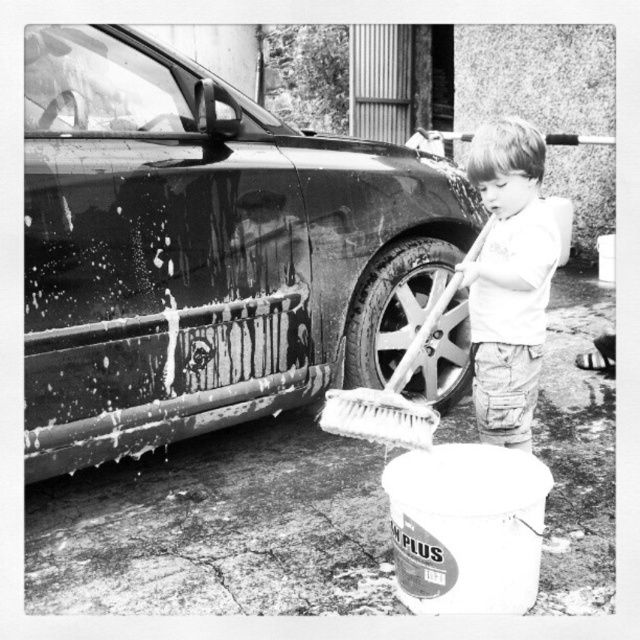
From the picture: Does shiny black car at left lie behind white bristle brush at lower center?

That is True.

Does shiny black car at left appear on the left side of white bristle brush at lower center?

Correct, you'll find shiny black car at left to the left of white bristle brush at lower center.

Who is more forward, (177,99) or (368,403)?

Point (368,403) is more forward.

Identify the location of shiny black car at left. (205, 250).

Can you confirm if metallic silver wheel at lower center is positioned to the right of white bristle brush at lower center?

Yes, metallic silver wheel at lower center is to the right of white bristle brush at lower center.

Which of these two, metallic silver wheel at lower center or white bristle brush at lower center, stands taller?

metallic silver wheel at lower center is taller.

I want to click on metallic silver wheel at lower center, so click(394, 307).

Is smooth white shirt at center thinner than metallic silver wheel at lower center?

Indeed, smooth white shirt at center has a lesser width compared to metallic silver wheel at lower center.

Find the location of a particular element. Image resolution: width=640 pixels, height=640 pixels. smooth white shirt at center is located at coordinates (508, 278).